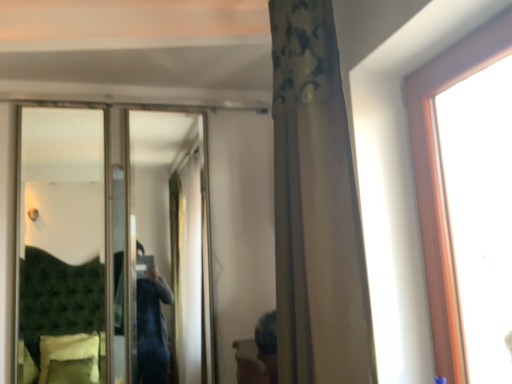
I want to click on empty space that is ontop of metallic silver mirror at center (from a real-world perspective), so click(106, 106).